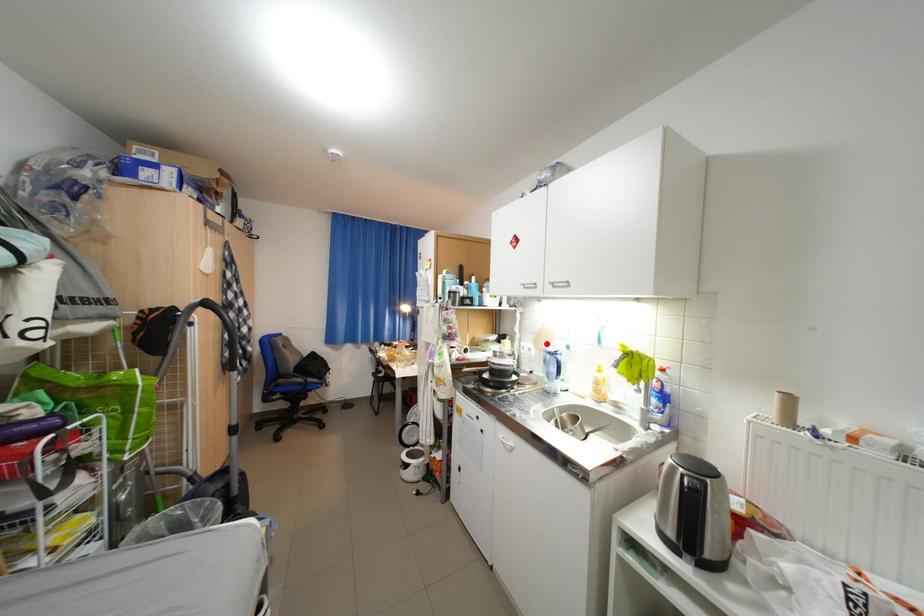
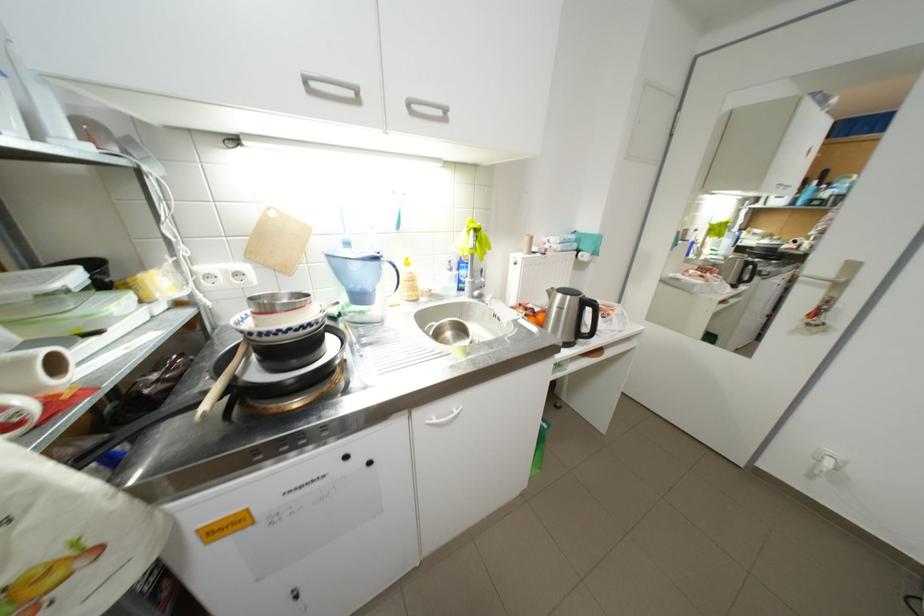
Locate, in the second image, the point that corresponds to the highlighted location in the first image.

(262, 256)